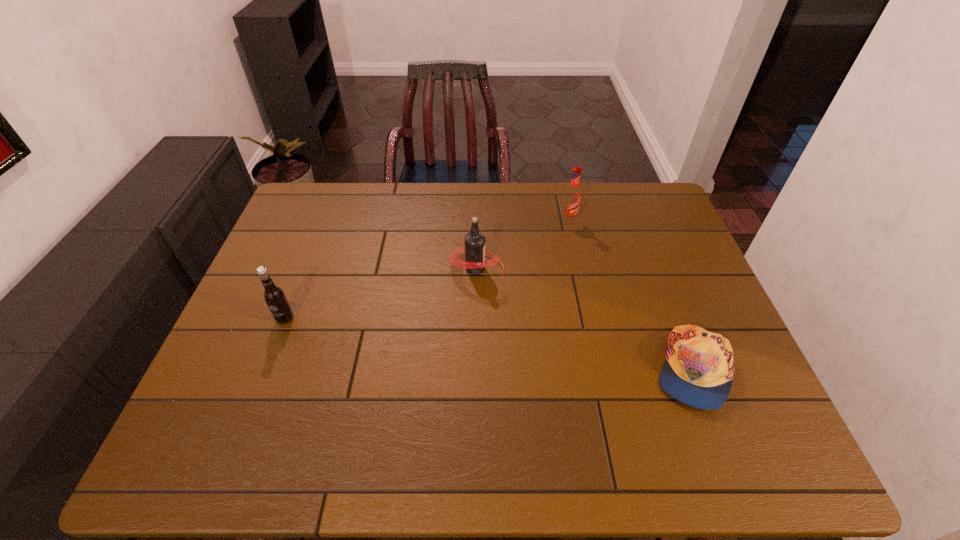
Where is `vacant space at the far right corner of the desktop`? The width and height of the screenshot is (960, 540). vacant space at the far right corner of the desktop is located at coordinates (614, 185).

At what (x,y) coordinates should I click in order to perform the action: click on empty space that is in between the nearest object and the third farthest object. Please return your answer as a coordinate pair (x, y). Looking at the image, I should click on (489, 344).

Where is `vacant space in between the leftmost root beer and the second object from left to right`? This screenshot has width=960, height=540. vacant space in between the leftmost root beer and the second object from left to right is located at coordinates click(x=380, y=293).

The height and width of the screenshot is (540, 960). Identify the location of vacant region between the third nearest object and the nearest root beer. (380, 293).

Find the location of a particular element. The height and width of the screenshot is (540, 960). vacant space that's between the third nearest object and the leftmost object is located at coordinates (380, 293).

Find the location of a particular element. free space between the second farthest object and the leftmost object is located at coordinates (380, 293).

I want to click on vacant area that lies between the leftmost object and the rightmost object, so click(x=489, y=344).

Find the location of a particular element. vacant point located between the nearest object and the second farthest object is located at coordinates (584, 319).

Where is `free spot between the nearest root beer and the farthest object`? free spot between the nearest root beer and the farthest object is located at coordinates (426, 270).

I want to click on free spot between the leftmost root beer and the farthest root beer, so click(426, 270).